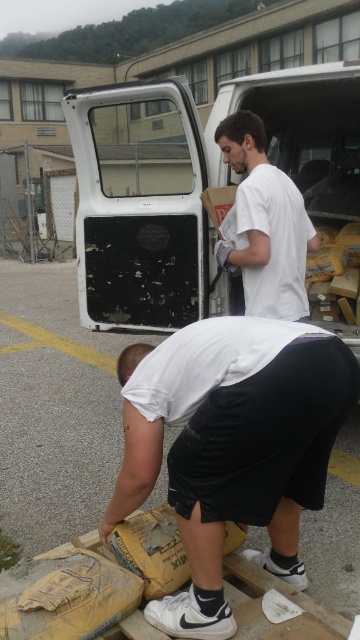
Is white matte truck door at upper center smaller than white matte shirt at center?

Incorrect, white matte truck door at upper center is not smaller in size than white matte shirt at center.

Between white matte truck door at upper center and white matte shirt at center, which one has less height?

With less height is white matte shirt at center.

Describe the element at coordinates (194, 184) in the screenshot. I see `white matte truck door at upper center` at that location.

At what (x,y) coordinates should I click in order to perform the action: click on white matte truck door at upper center. Please return your answer as a coordinate pair (x, y). The image size is (360, 640). Looking at the image, I should click on (194, 184).

Can you confirm if white matte truck door at upper center is shorter than white matte shorts at lower center?

Incorrect, white matte truck door at upper center's height does not fall short of white matte shorts at lower center's.

Which of these two, white matte truck door at upper center or white matte shorts at lower center, stands shorter?

white matte shorts at lower center is shorter.

Which is in front, point (79, 134) or point (309, 445)?

Positioned in front is point (309, 445).

Identify the location of white matte truck door at upper center. Image resolution: width=360 pixels, height=640 pixels. (194, 184).

Based on the photo, is white matte shorts at lower center below white matte shirt at center?

Yes, white matte shorts at lower center is below white matte shirt at center.

From the picture: Can you confirm if white matte shorts at lower center is positioned to the right of white matte shirt at center?

In fact, white matte shorts at lower center is to the left of white matte shirt at center.

Which is in front, point (290, 458) or point (250, 195)?

Point (290, 458) is in front.

Where is `white matte shorts at lower center`? white matte shorts at lower center is located at coordinates (231, 445).